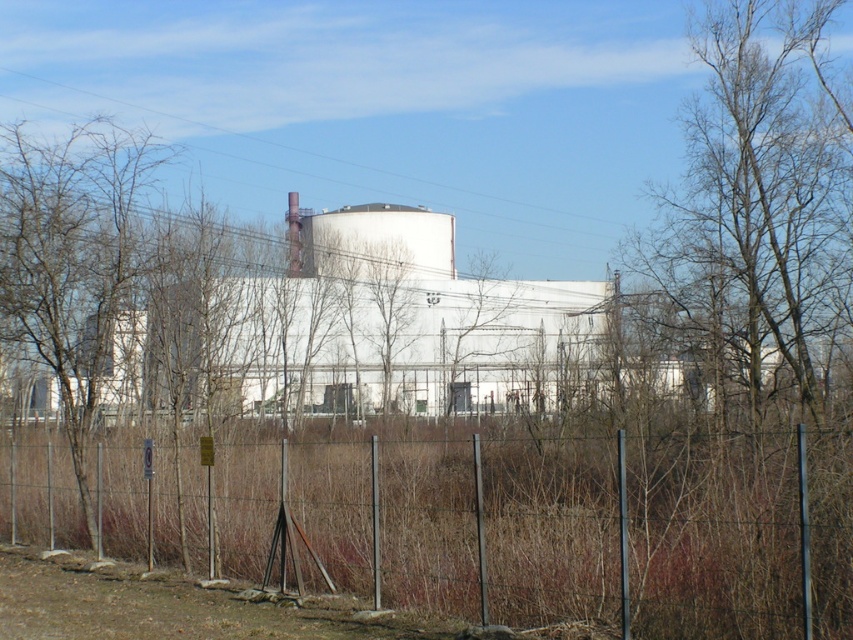
You are standing at the fence looking towards the building. There are two points marked in the image, one at coordinates point (618,552) and the other at point (106,276). Which point is nearer to your current position?

Point (618,552) is closer to the camera than point (106,276), so the point at (618,552) is nearer to your current position at the fence.

You are standing at the point marked as point (467, 522) in the image. What object is directly beneath your feet?

The metal wire fence at center is directly beneath point (467, 522).